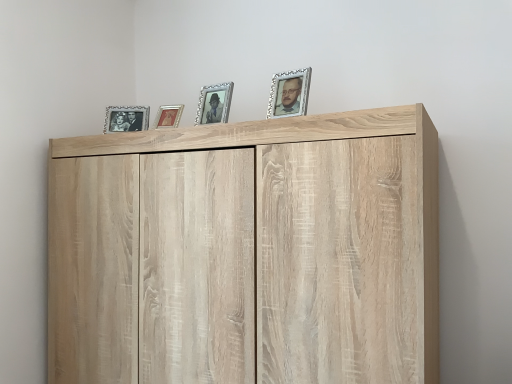
Question: From a real-world perspective, is silver/glass picture frame at center, the third picture frame in the left-to-right sequence, positioned above or below matte silver picture frame at upper left, which ranks as the fourth picture frame in right-to-left order?

Choices:
 (A) above
 (B) below

Answer: (A)

Question: Is silver/glass picture frame at center, the second picture frame from the right, wider or thinner than matte silver picture frame at upper left, which is the 1th picture frame from back to front?

Choices:
 (A) thin
 (B) wide

Answer: (A)

Question: Considering the real-world distances, which object is farthest from the metallic gold picture frame at center, the 3th picture frame viewed from the front?

Choices:
 (A) silver/glass picture frame at center, placed as the 2th picture frame when sorted from front to back
 (B) silver/glass picture frame at upper right, the 4th picture frame when ordered from back to front
 (C) light wood cupboard at upper center
 (D) matte silver picture frame at upper left, which is the fourth picture frame from front to back

Answer: (C)

Question: Which is farther from the metallic gold picture frame at center, the 3th picture frame viewed from the front?

Choices:
 (A) silver/glass picture frame at upper right, the first picture frame in the right-to-left sequence
 (B) silver/glass picture frame at center, the second picture frame from the right
 (C) matte silver picture frame at upper left, which is the 1th picture frame in left-to-right order
 (D) light wood cupboard at upper center

Answer: (D)